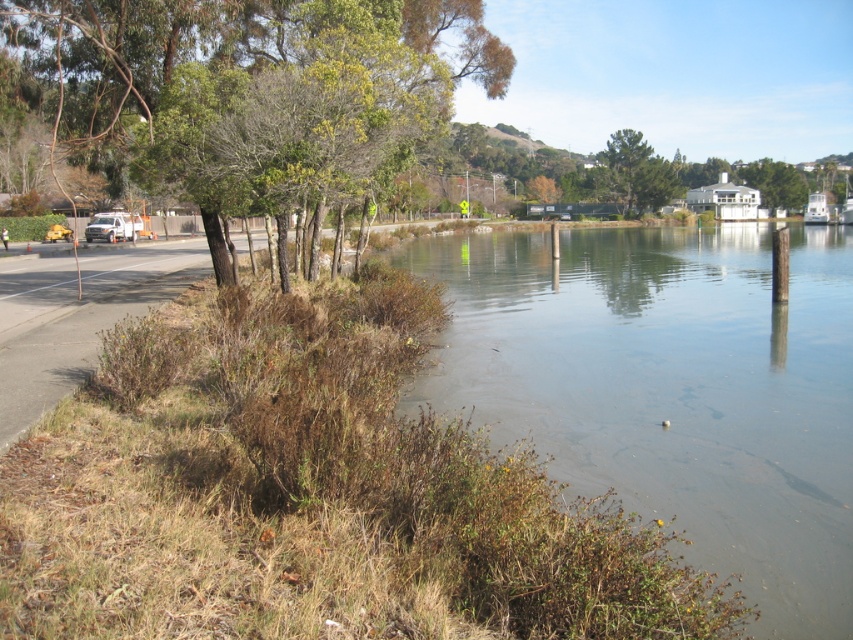
Can you confirm if brown grassy river at lower left is wider than green leafy tree at upper left?

Correct, the width of brown grassy river at lower left exceeds that of green leafy tree at upper left.

From the picture: Between brown grassy river at lower left and green leafy tree at upper left, which one appears on the left side from the viewer's perspective?

From the viewer's perspective, green leafy tree at upper left appears more on the left side.

Who is more distant from viewer, (714, 376) or (442, 20)?

Point (442, 20)

Find the location of a particular element. This screenshot has height=640, width=853. brown grassy river at lower left is located at coordinates (671, 388).

Who is higher up, green matte tree at upper center or white matte van at left?

Positioned higher is green matte tree at upper center.

Identify the location of green matte tree at upper center. (635, 172).

Between point (607, 144) and point (90, 230), which one is positioned behind?

The point (607, 144) is behind.

Image resolution: width=853 pixels, height=640 pixels. Find the location of `green matte tree at upper center`. green matte tree at upper center is located at coordinates (635, 172).

Is point (749, 346) positioned behind point (647, 193)?

That is False.

Between point (457, 314) and point (613, 156), which one is positioned behind?

Point (613, 156)

Is point (561, 330) positioned before point (650, 195)?

Yes.

At what (x,y) coordinates should I click in order to perform the action: click on brown grassy river at lower left. Please return your answer as a coordinate pair (x, y). Image resolution: width=853 pixels, height=640 pixels. Looking at the image, I should click on (671, 388).